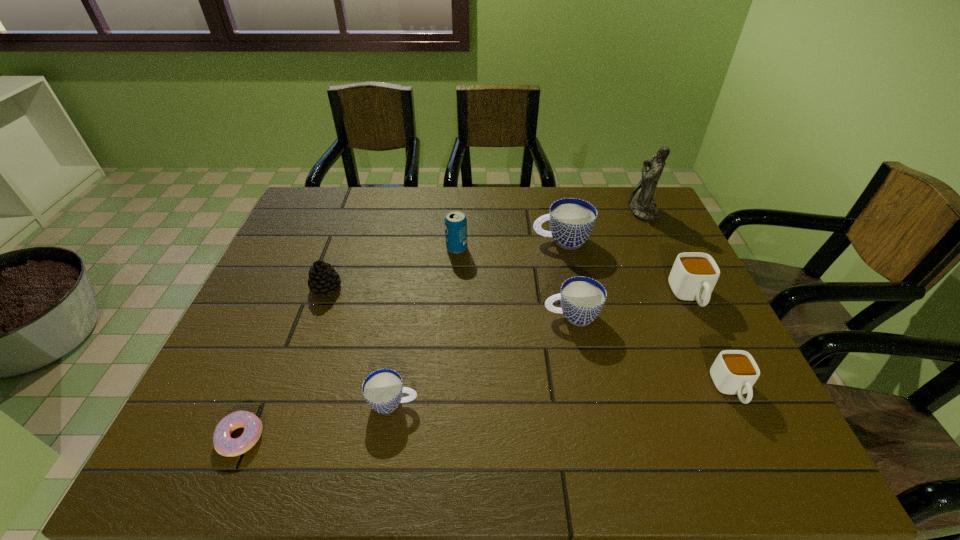
What are the coordinates of `vacant space at the right edge of the desktop` in the screenshot? It's located at (730, 406).

I want to click on vacant region at the far right corner of the desktop, so click(x=626, y=211).

This screenshot has height=540, width=960. I want to click on free space between the third object from left to right and the bigger white cup, so click(x=541, y=350).

In order to click on free space between the farther white cup and the pinecone in this screenshot , I will do `click(508, 292)`.

The height and width of the screenshot is (540, 960). Find the location of `free point between the bigger white cup and the second smallest blue cup`. free point between the bigger white cup and the second smallest blue cup is located at coordinates (631, 306).

Locate an element on the screen. Image resolution: width=960 pixels, height=540 pixels. vacant point located between the farthest blue cup and the leftmost blue cup is located at coordinates (477, 322).

Locate an element on the screen. Image resolution: width=960 pixels, height=540 pixels. vacant region between the farthest blue cup and the blue soda can is located at coordinates (509, 244).

Where is `free space between the farthest blue cup and the second smallest blue cup`? free space between the farthest blue cup and the second smallest blue cup is located at coordinates coord(566,278).

You are a GUI agent. You are given a task and a screenshot of the screen. Output one action in this format:
    pyautogui.click(x=<x>, y=<y>)
    Task: Click on the free spot between the blue soda can and the farther white cup
    The image size is (960, 540).
    Given the screenshot: What is the action you would take?
    pyautogui.click(x=574, y=272)

Image resolution: width=960 pixels, height=540 pixels. I want to click on free spot between the second nearest blue cup and the bigger white cup, so click(631, 306).